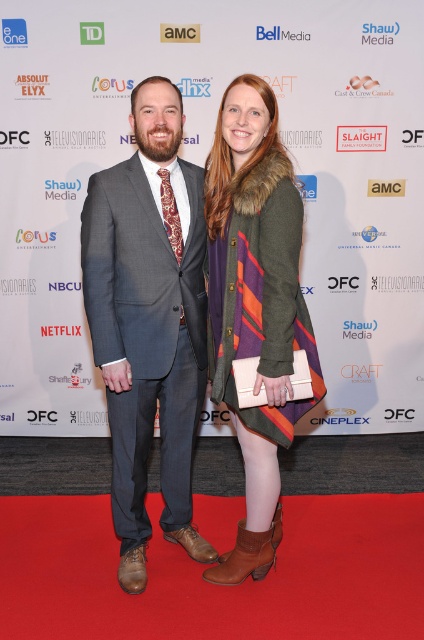
Measure the distance between gray textured suit at center and camera.

They are 6.39 feet apart.

Who is more distant from viewer, (122, 330) or (279, 323)?

Positioned behind is point (122, 330).

Where is `gray textured suit at center`? Image resolution: width=424 pixels, height=640 pixels. gray textured suit at center is located at coordinates (148, 321).

In order to click on gray textured suit at center in this screenshot , I will do `click(148, 321)`.